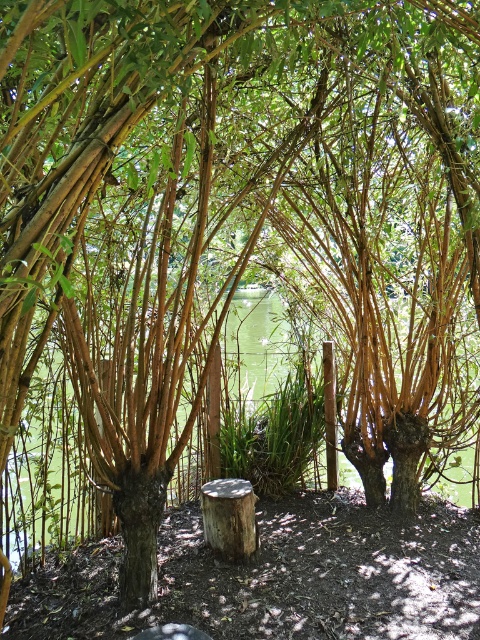
Question: Which of the following is the closest to the observer?

Choices:
 (A) light brown wood stump at center
 (B) green liquid water at center

Answer: (B)

Question: Is green liquid water at center closer to camera compared to light brown wood stump at center?

Choices:
 (A) yes
 (B) no

Answer: (A)

Question: Which of the following is the closest to the observer?

Choices:
 (A) light brown wood stump at center
 (B) green liquid water at center

Answer: (B)

Question: Does green liquid water at center lie behind light brown wood stump at center?

Choices:
 (A) yes
 (B) no

Answer: (B)

Question: Is green liquid water at center below light brown wood stump at center?

Choices:
 (A) yes
 (B) no

Answer: (B)